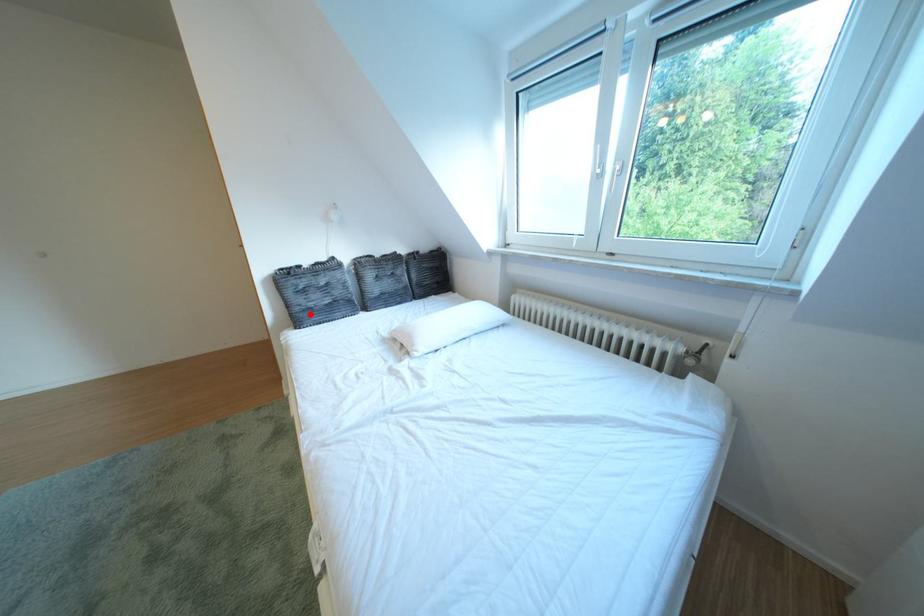
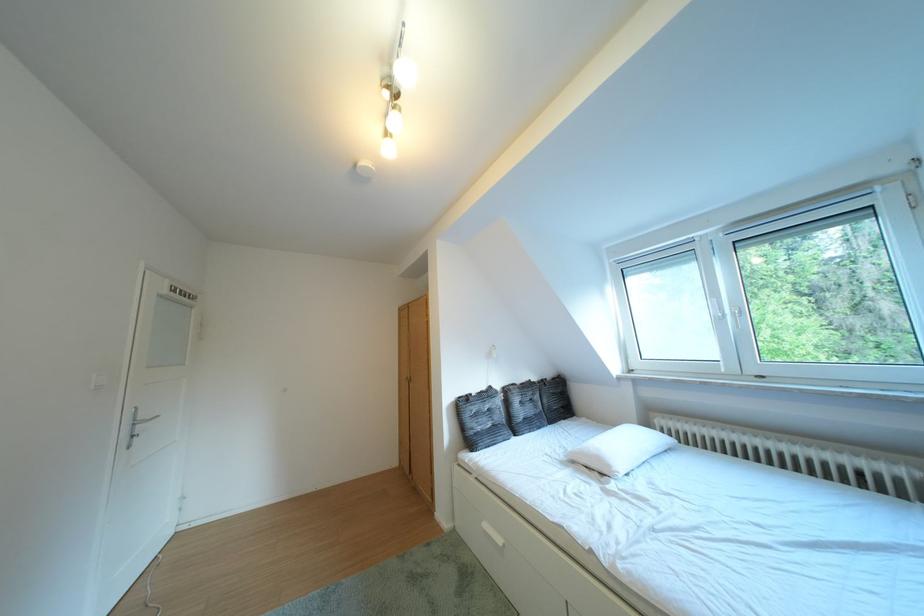
The point at the highlighted location is marked in the first image. Where is the corresponding point in the second image?

(484, 438)